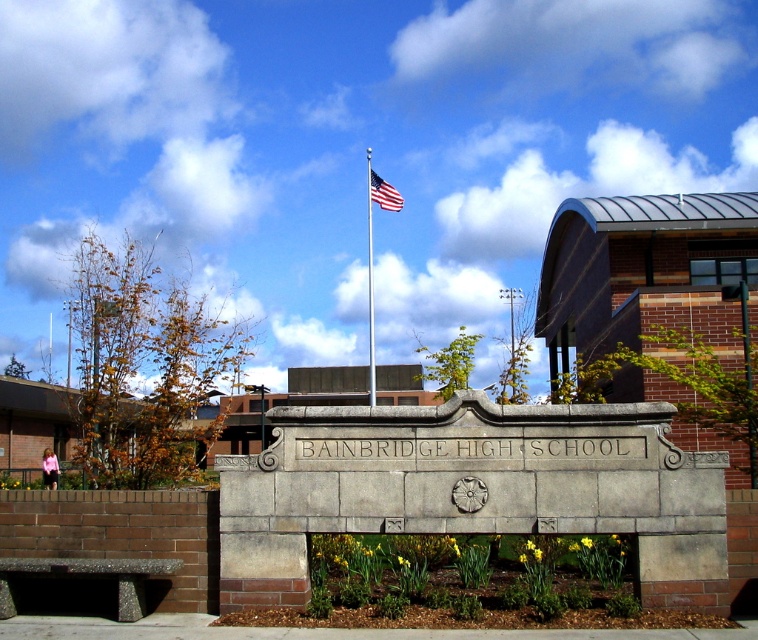
You are standing at the engraved stone sign in the foreground of Bainbridge High School. You see a point marked at coordinates (370, 285). What object is located at that point?

The point at coordinates (370, 285) marks the location of the polished metal flag pole at center.

You are a visitor approaching the entrance of Bainbridge High School. You see the polished metal flag pole at center and the american flag at center. Which object is closer to you as you approach the school entrance?

The polished metal flag pole at center is closer to you because it is positioned in front of the american flag at center.